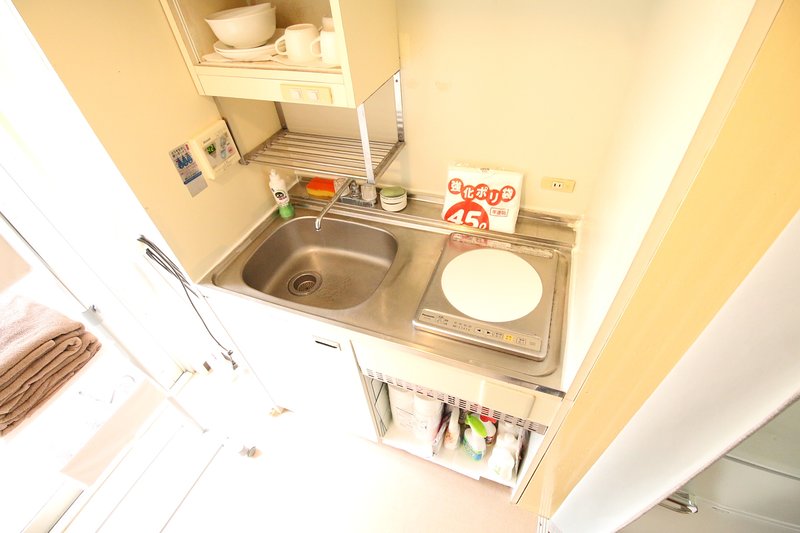
Image resolution: width=800 pixels, height=533 pixels. What are the coordinates of `steel dry rack` in the screenshot? It's located at (338, 153).